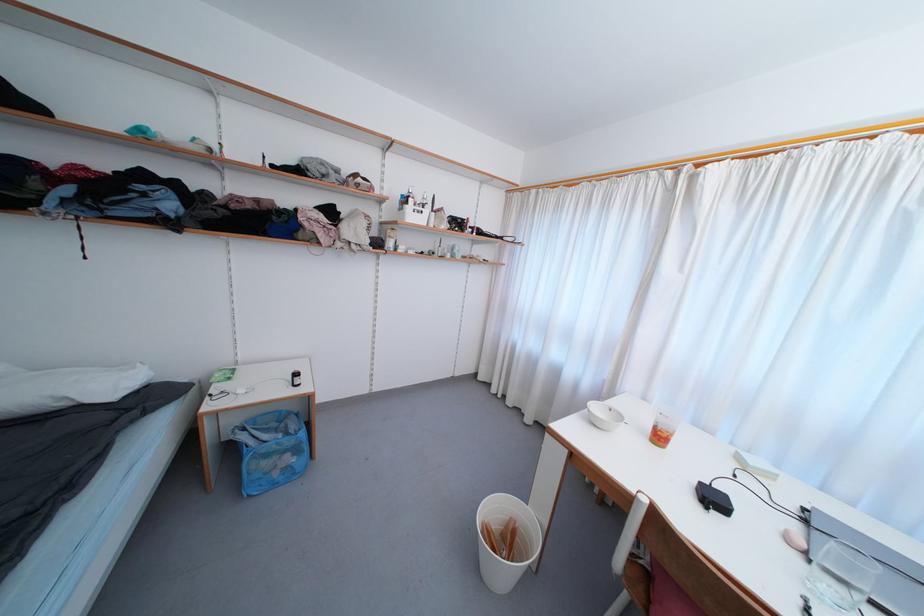
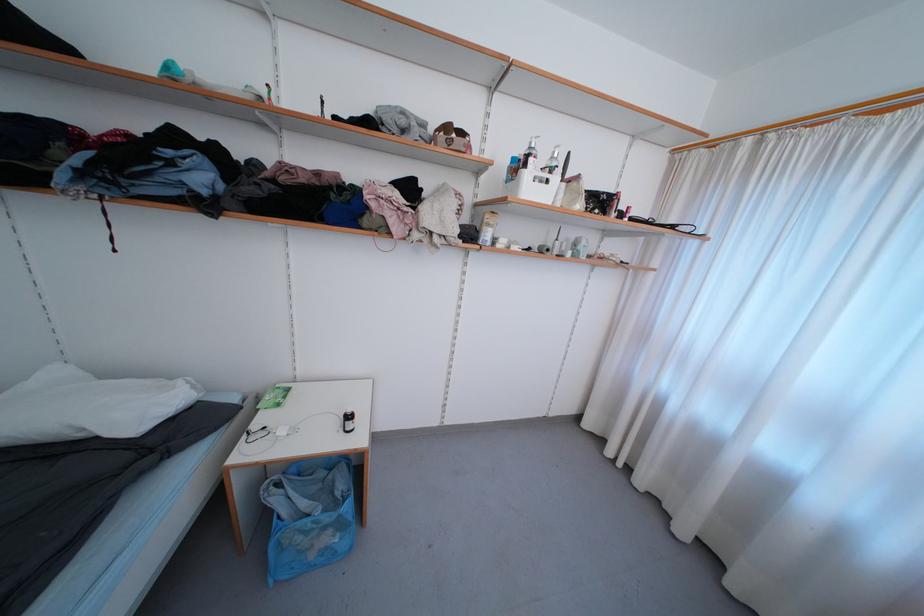
Locate, in the second image, the point that corresponds to point 447,228 in the first image.

(584, 208)